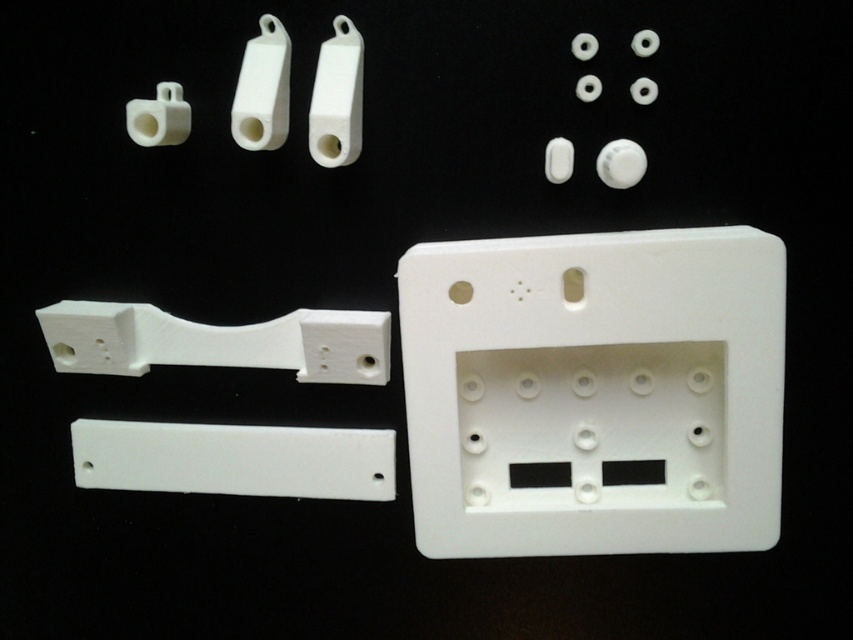
You are assembling a device and need to place the white plastic electric outlet at center and the white matte rectangular plate at lower left. According to the layout, which one is positioned to the right side?

The white plastic electric outlet at center is positioned to the right of the white matte rectangular plate at lower left.

You are an engineer inspecting the components. You need to determine if the white plastic electric outlet at center can be mounted on the white matte rectangular plate at lower left. Based on their sizes, is this possible?

The white plastic electric outlet at center is taller than the white matte rectangular plate at lower left, so it cannot be mounted on the plate since it is taller than the plate.